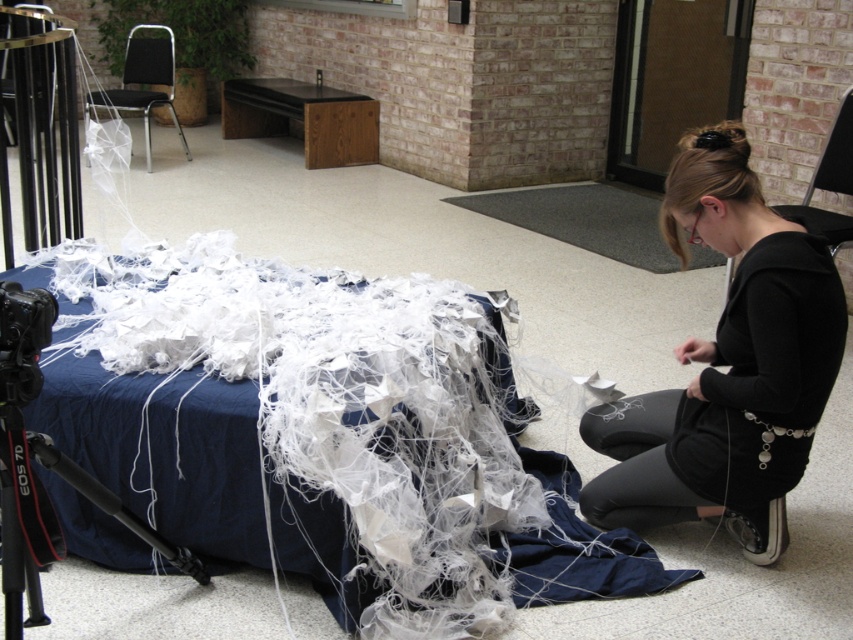
You are standing in the hallway and see two points marked on the floor. The first point is at coordinate point (6, 472) and the second is at point (18, 35). Which point is closer to you?

Point (6, 472) is closer to the viewer than point (18, 35).

Consider the image. You are setting up a photo shoot in this space and need to move the black metal tripod at lower left closer to the black plastic chair at upper right. How much distance do you need to cover to bring them together?

The black metal tripod at lower left and black plastic chair at upper right are 8.76 feet apart, so you need to cover 8.76 feet to bring them together.

You are a photographer standing in the hallway and want to move closer to the black fabric at lower right to adjust its position. If you are currently 2 meters away from it, can you reach it without moving past the table?

The black fabric at lower right is 1.91 meters away from the viewer, so yes, you can reach it without moving past the table since you are only 2 meters away, which is slightly farther than the required distance.